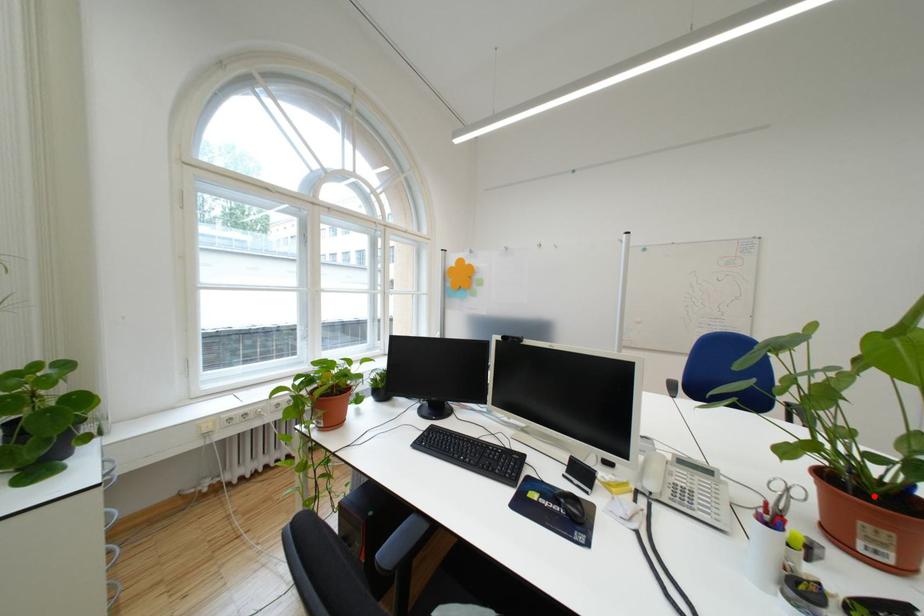
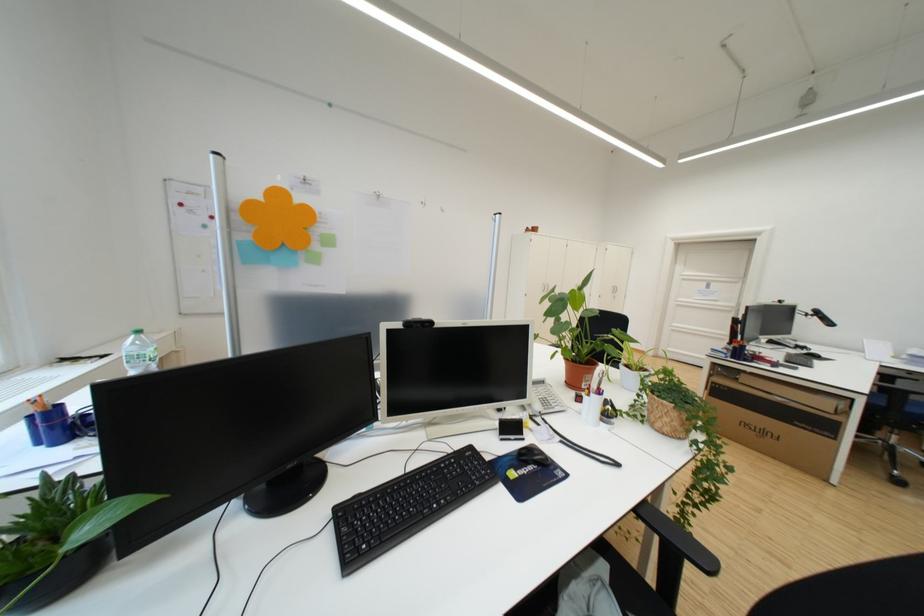
Question: I am providing you with two images of the same scene from different viewpoints. Given a red point in image1, look at the same physical point in image2. Is it:

Choices:
 (A) Closer to the viewpoint
 (B) Farther from the viewpoint

Answer: (B)